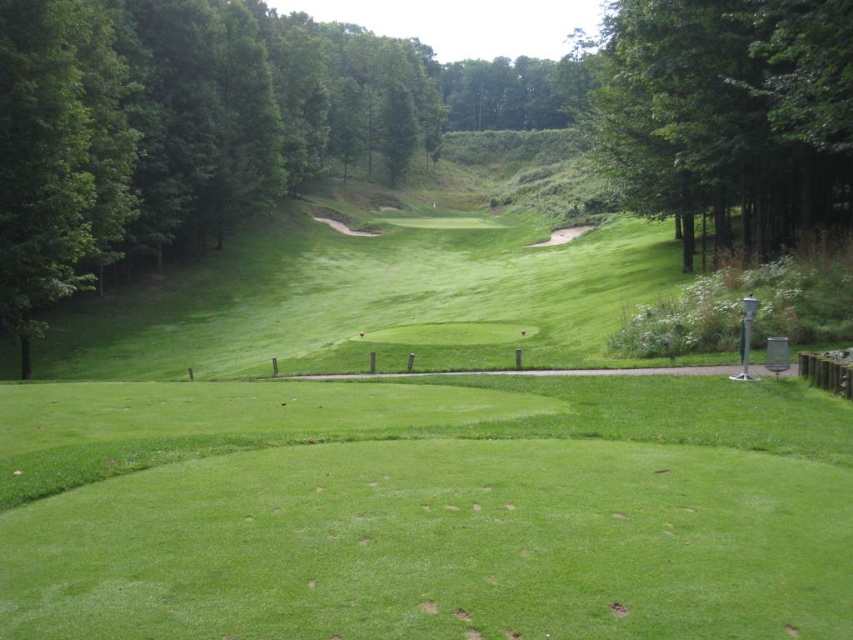
Question: Does green grassy field at center have a larger size compared to green leafy tree at left?

Choices:
 (A) no
 (B) yes

Answer: (A)

Question: Estimate the real-world distances between objects in this image. Which object is closer to the green leafy tree at upper right?

Choices:
 (A) green grassy field at center
 (B) green leafy tree at left

Answer: (A)

Question: Can you confirm if green leafy tree at left is positioned below green leafy tree at upper right?

Choices:
 (A) no
 (B) yes

Answer: (A)

Question: Does green leafy tree at left have a smaller size compared to green leafy tree at upper right?

Choices:
 (A) yes
 (B) no

Answer: (B)

Question: Which object appears farthest from the camera in this image?

Choices:
 (A) green grassy field at center
 (B) green leafy tree at left
 (C) green leafy tree at upper right

Answer: (B)

Question: Which object is farther from the camera taking this photo?

Choices:
 (A) green leafy tree at left
 (B) green grassy field at center
 (C) green leafy tree at upper right

Answer: (A)